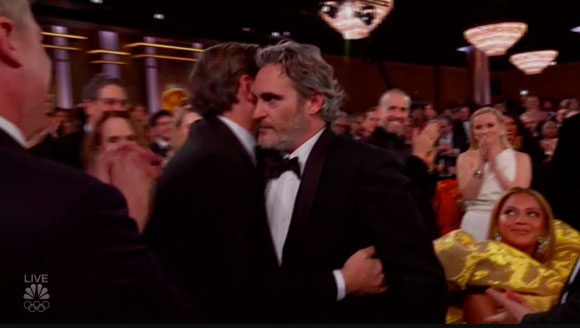
Image resolution: width=580 pixels, height=328 pixels. I want to click on ceiling lights, so click(158, 19), click(276, 34), click(575, 30).